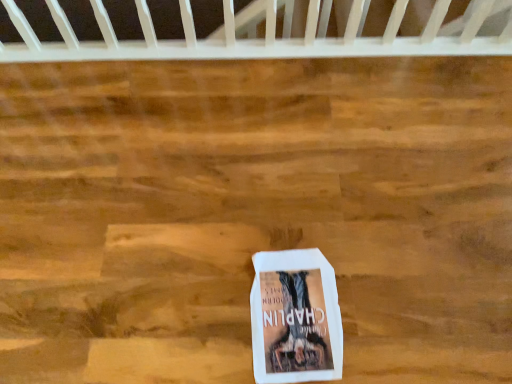
Question: Would you say white paper book at center is inside or outside white plastic crib at upper center?

Choices:
 (A) outside
 (B) inside

Answer: (A)

Question: Considering the positions of point (323, 299) and point (12, 6), is point (323, 299) closer or farther from the camera than point (12, 6)?

Choices:
 (A) farther
 (B) closer

Answer: (B)

Question: Considering the positions of white paper book at center and white plastic crib at upper center in the image, is white paper book at center taller or shorter than white plastic crib at upper center?

Choices:
 (A) tall
 (B) short

Answer: (B)

Question: From a real-world perspective, is white plastic crib at upper center physically located above or below white paper book at center?

Choices:
 (A) below
 (B) above

Answer: (B)

Question: Relative to white paper book at center, is white plastic crib at upper center in front or behind?

Choices:
 (A) front
 (B) behind

Answer: (B)

Question: From the image's perspective, is white plastic crib at upper center above or below white paper book at center?

Choices:
 (A) above
 (B) below

Answer: (A)

Question: Considering the relative positions of white plastic crib at upper center and white paper book at center in the image provided, is white plastic crib at upper center to the left or to the right of white paper book at center?

Choices:
 (A) left
 (B) right

Answer: (A)